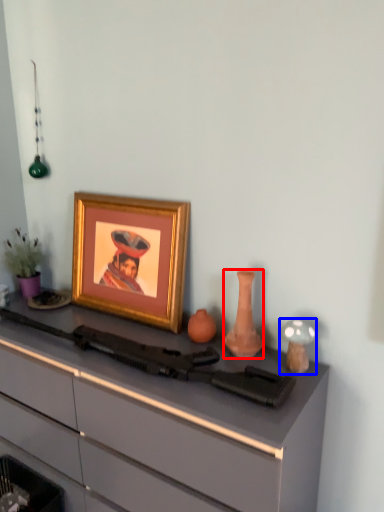
Question: Which object is closer to the camera taking this photo, vase (highlighted by a red box) or candle holder (highlighted by a blue box)?

Choices:
 (A) vase
 (B) candle holder

Answer: (B)